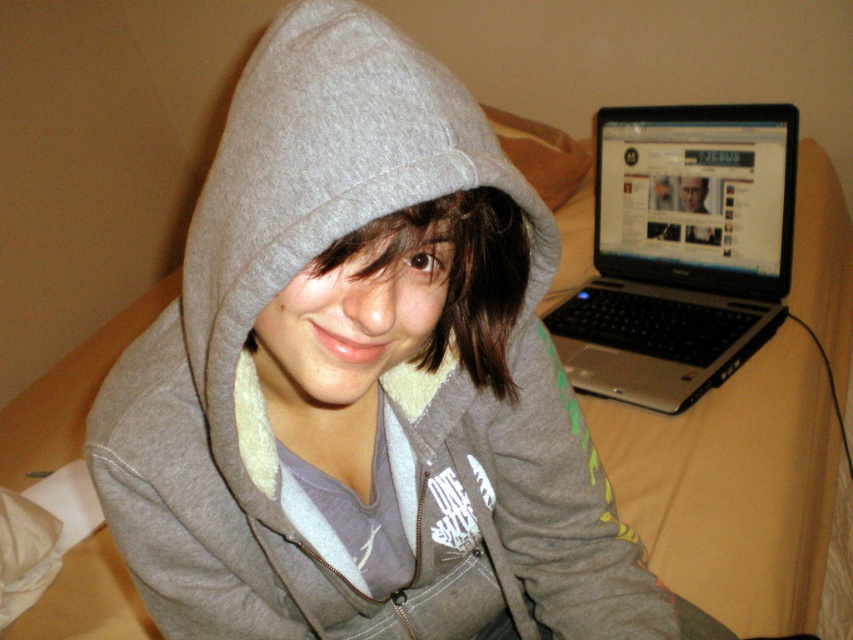
You are holding a 12 inch ruler and want to measure the distance from your eyes to the point marked as point (355, 36) in the image. Can you do it with the ruler?

The point (355, 36) is 15.50 inches away from the viewer, so yes, you can measure the distance with a 12 inch ruler since it is shorter than the distance.